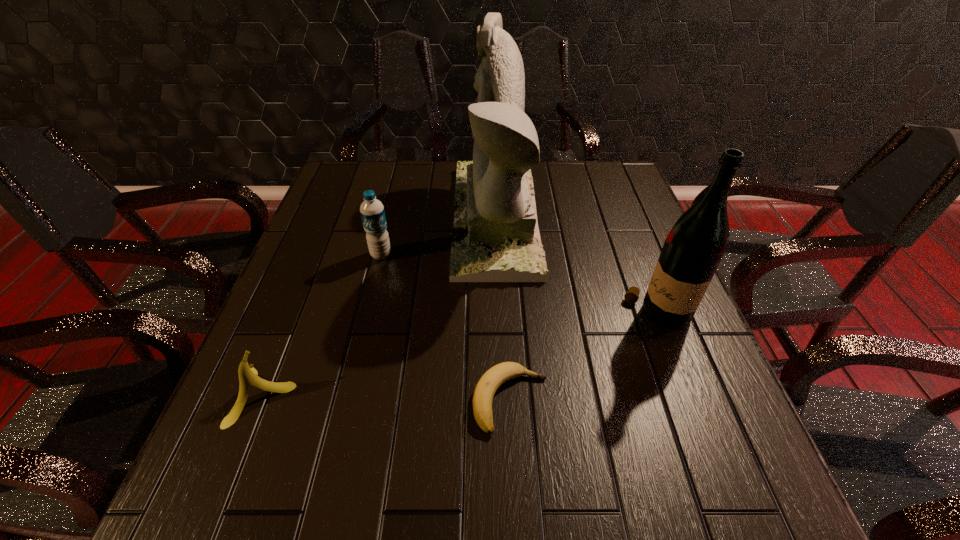
The image size is (960, 540). Identify the location of object positioned at the right edge. (693, 249).

Locate an element on the screen. This screenshot has width=960, height=540. free spot at the near edge of the desktop is located at coordinates (400, 488).

In the image, there is a desktop. Find the location of `free space at the left edge`. free space at the left edge is located at coordinates (234, 462).

At what (x,y) coordinates should I click in order to perform the action: click on vacant space at the right edge. Please return your answer as a coordinate pair (x, y). The image size is (960, 540). Looking at the image, I should click on (699, 342).

Image resolution: width=960 pixels, height=540 pixels. Find the location of `free space at the far left corner of the desktop`. free space at the far left corner of the desktop is located at coordinates (351, 193).

Locate an element on the screen. The image size is (960, 540). vacant space at the near left corner is located at coordinates (255, 500).

Locate an element on the screen. The image size is (960, 540). vacant region at the far right corner of the desktop is located at coordinates (628, 196).

Locate an element on the screen. The height and width of the screenshot is (540, 960). free space at the near right corner is located at coordinates (683, 487).

I want to click on unoccupied position between the second object from left to right and the right banana, so (x=446, y=328).

The width and height of the screenshot is (960, 540). I want to click on free space between the rightmost object and the sculpture, so click(x=576, y=267).